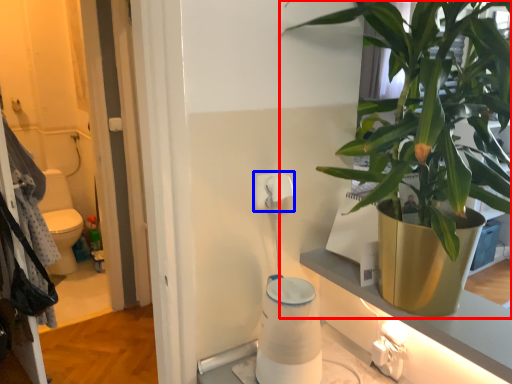
Question: Which object appears farthest to the camera in this image, houseplant (highlighted by a red box) or toilet paper (highlighted by a blue box)?

Choices:
 (A) houseplant
 (B) toilet paper

Answer: (B)